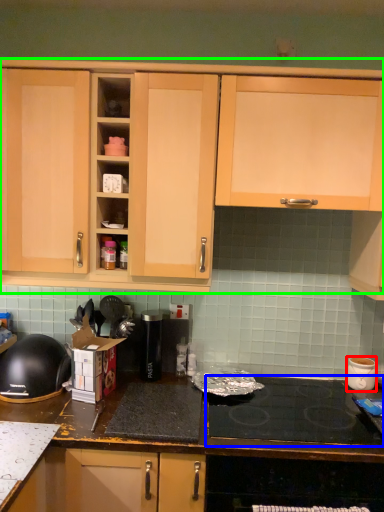
Question: Which object is positioned closest to kitchen appliance (highlighted by a red box)? Select from gas stove (highlighted by a blue box) and cabinetry (highlighted by a green box).

Choices:
 (A) gas stove
 (B) cabinetry

Answer: (A)